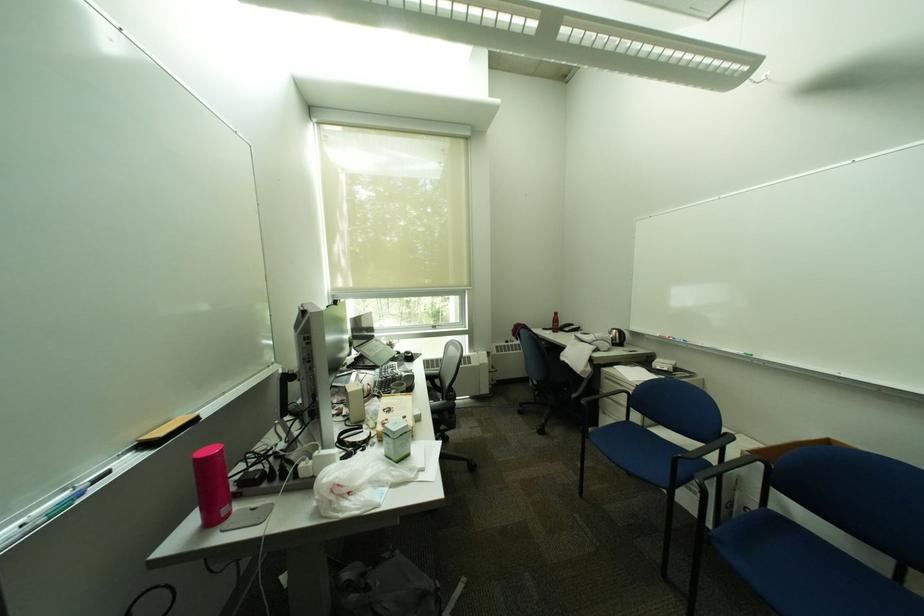
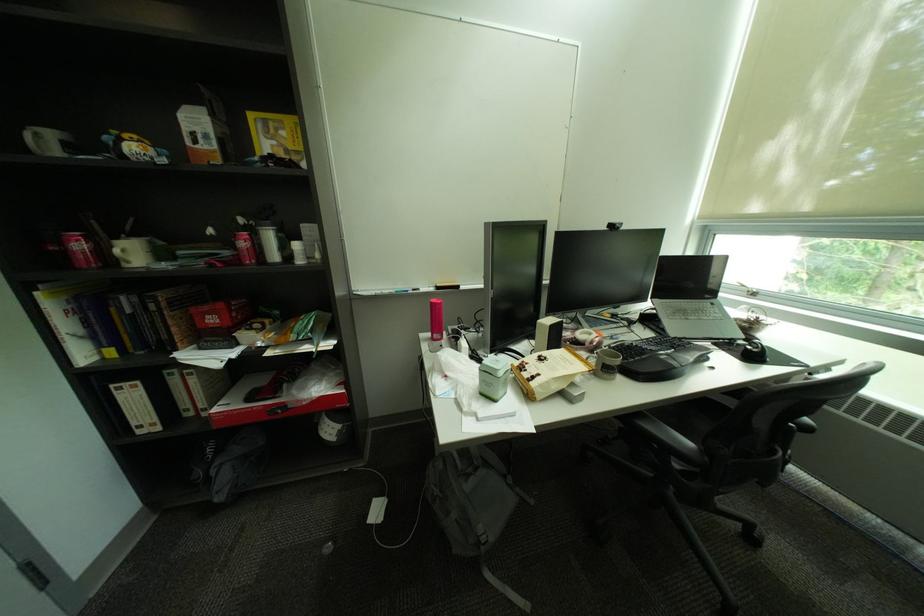
The point at (421, 355) is marked in the first image. Where is the corresponding point in the second image?

(766, 352)